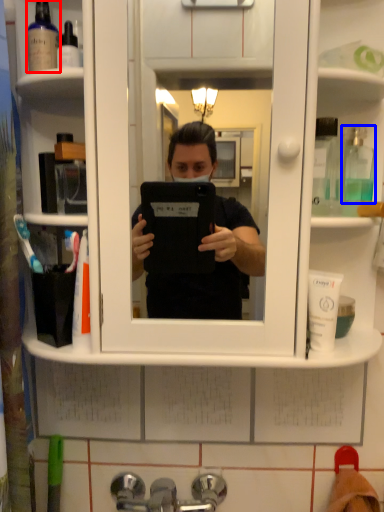
Question: Which object is further to the camera taking this photo, mouthwash (highlighted by a red box) or mouthwash (highlighted by a blue box)?

Choices:
 (A) mouthwash
 (B) mouthwash

Answer: (A)